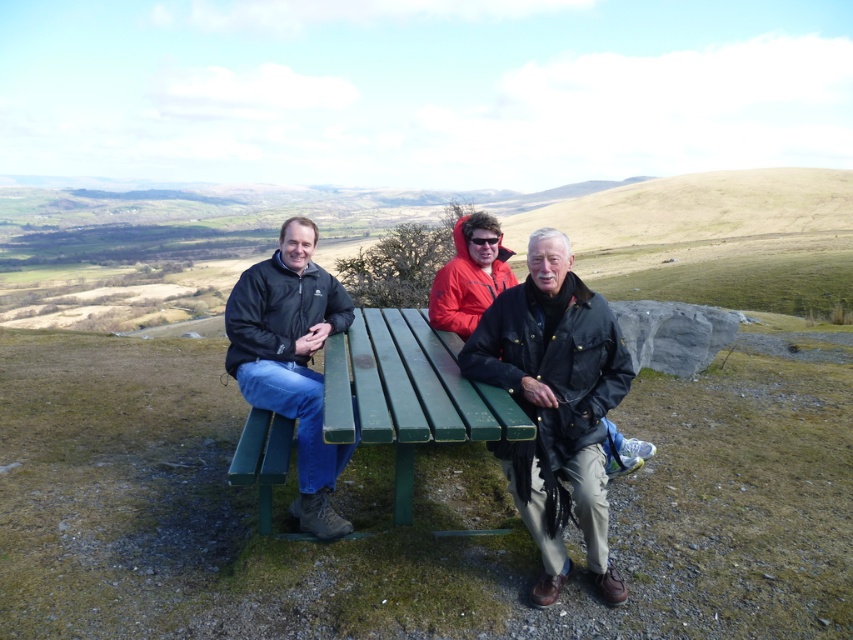
Measure the distance between black leather jacket at center and camera.

The distance of black leather jacket at center from camera is 8.22 feet.

Does black leather jacket at center appear under orange softshell jacket at center?

Indeed, black leather jacket at center is positioned under orange softshell jacket at center.

Between point (543, 376) and point (459, 253), which one is positioned in front?

Point (543, 376) is in front.

The height and width of the screenshot is (640, 853). What are the coordinates of `black leather jacket at center` in the screenshot? It's located at (556, 404).

Does point (393, 492) come behind point (345, 532)?

That is True.

Can you confirm if green painted wood table at center is positioned to the right of matte black jacket at left?

Yes, green painted wood table at center is to the right of matte black jacket at left.

Describe the element at coordinates (408, 392) in the screenshot. I see `green painted wood table at center` at that location.

Where is `green painted wood table at center`? green painted wood table at center is located at coordinates (408, 392).

Is point (271, 284) farther from viewer compared to point (492, 294)?

No.

Between matte black jacket at left and orange softshell jacket at center, which one has less height?

orange softshell jacket at center

Image resolution: width=853 pixels, height=640 pixels. I want to click on matte black jacket at left, so click(291, 358).

This screenshot has width=853, height=640. I want to click on matte black jacket at left, so click(x=291, y=358).